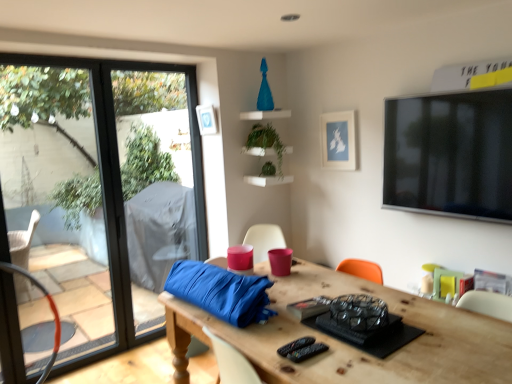
Question: Can you confirm if green matte plant at center, which is counted as the second plant, starting from the bottom, is smaller than wooden table at center?

Choices:
 (A) yes
 (B) no

Answer: (A)

Question: Is green matte plant at center, the 1th plant from the top, in front of wooden table at center?

Choices:
 (A) no
 (B) yes

Answer: (A)

Question: From a real-world perspective, does green matte plant at center, which is counted as the second plant, starting from the bottom, stand above wooden table at center?

Choices:
 (A) yes
 (B) no

Answer: (A)

Question: Is green matte plant at center, which is counted as the second plant, starting from the bottom, turned away from wooden table at center?

Choices:
 (A) yes
 (B) no

Answer: (B)

Question: Is green matte plant at center, which is counted as the second plant, starting from the bottom, facing towards wooden table at center?

Choices:
 (A) no
 (B) yes

Answer: (A)

Question: Can you confirm if green matte plant at center, the 1th plant from the top, is taller than wooden table at center?

Choices:
 (A) yes
 (B) no

Answer: (B)

Question: Considering the relative positions of metallic orange swivel chair at left and green matte plant at center, the 1th plant from the top, in the image provided, is metallic orange swivel chair at left to the left of green matte plant at center, the 1th plant from the top, from the viewer's perspective?

Choices:
 (A) no
 (B) yes

Answer: (B)

Question: Does metallic orange swivel chair at left have a lesser width compared to green matte plant at center, which is counted as the second plant, starting from the bottom?

Choices:
 (A) no
 (B) yes

Answer: (B)

Question: Is metallic orange swivel chair at left not inside green matte plant at center, which is counted as the second plant, starting from the bottom?

Choices:
 (A) yes
 (B) no

Answer: (A)

Question: Does metallic orange swivel chair at left have a lesser height compared to green matte plant at center, which is counted as the second plant, starting from the bottom?

Choices:
 (A) no
 (B) yes

Answer: (A)

Question: Is metallic orange swivel chair at left at the right side of green matte plant at center, the 1th plant from the top?

Choices:
 (A) yes
 (B) no

Answer: (B)

Question: Does metallic orange swivel chair at left come in front of green matte plant at center, which is counted as the second plant, starting from the bottom?

Choices:
 (A) yes
 (B) no

Answer: (A)

Question: Is transparent glass window at left turned away from green matte plant at center, which is counted as the second plant, starting from the bottom?

Choices:
 (A) yes
 (B) no

Answer: (B)